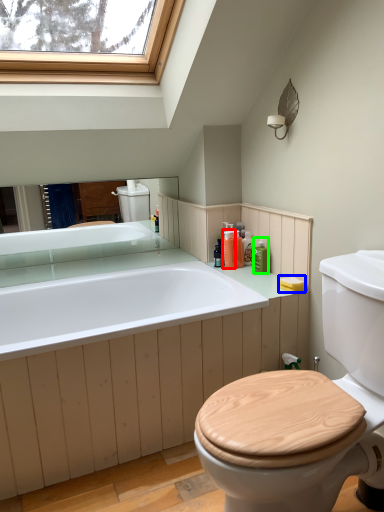
Question: Estimate the real-world distances between objects in this image. Which object is closer to toiletry (highlighted by a red box), soap (highlighted by a blue box) or toiletry (highlighted by a green box)?

Choices:
 (A) soap
 (B) toiletry

Answer: (B)